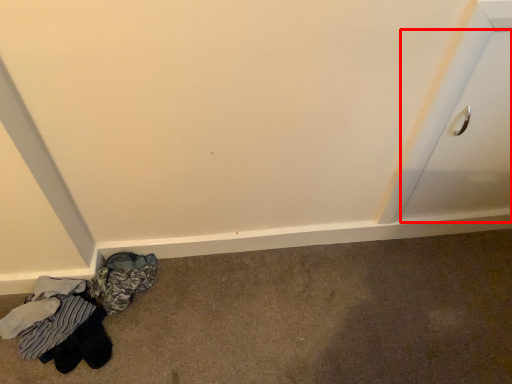
Question: From the image's perspective, what is the correct spatial positioning of drawer (annotated by the red box) in reference to laundry?

Choices:
 (A) above
 (B) below

Answer: (A)